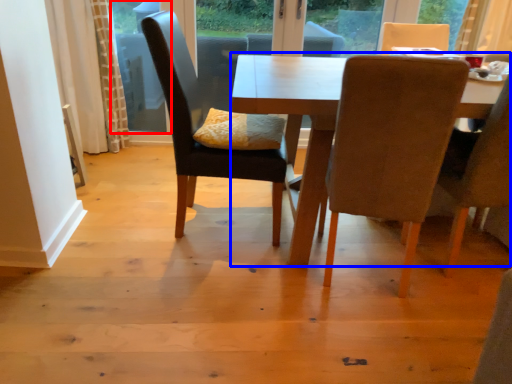
Question: Which object appears farthest to the camera in this image, window screen (highlighted by a red box) or kitchen & dining room table (highlighted by a blue box)?

Choices:
 (A) window screen
 (B) kitchen & dining room table

Answer: (A)